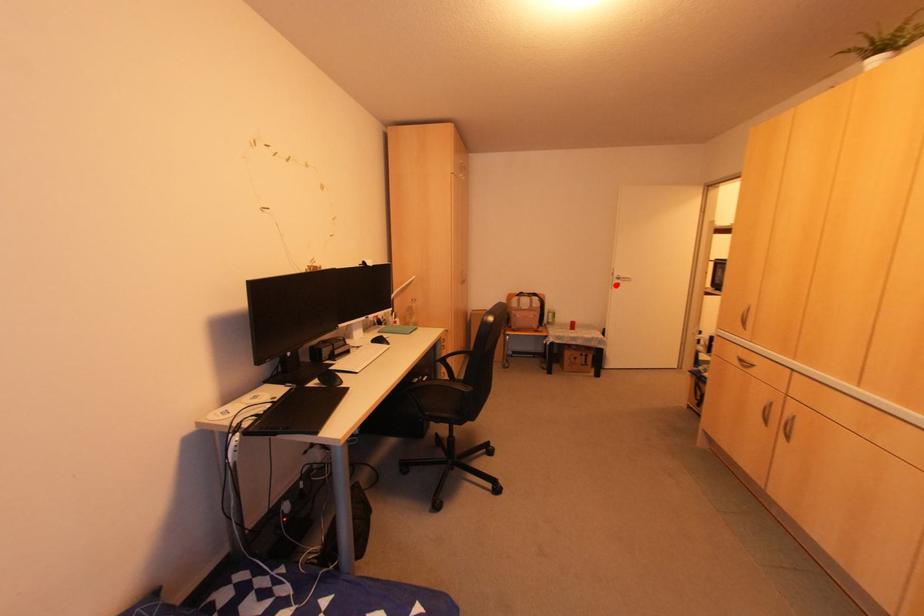
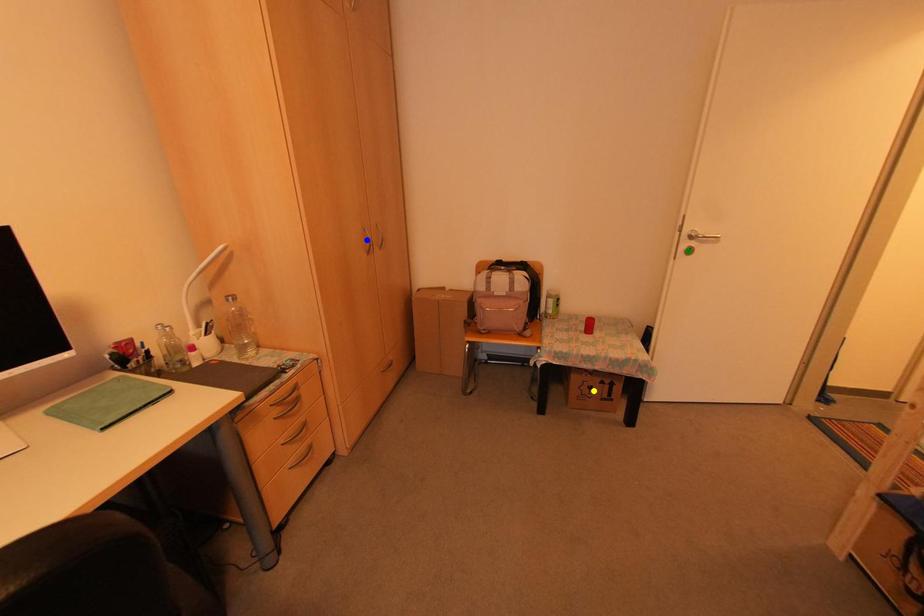
Question: I am providing you with two images of the same scene from different viewpoints. A red point is marked on the first image. You are given multiple points on the second image. Which spot in image 2 lines up with the point in image 1?

Choices:
 (A) green point
 (B) blue point
 (C) yellow point

Answer: (A)